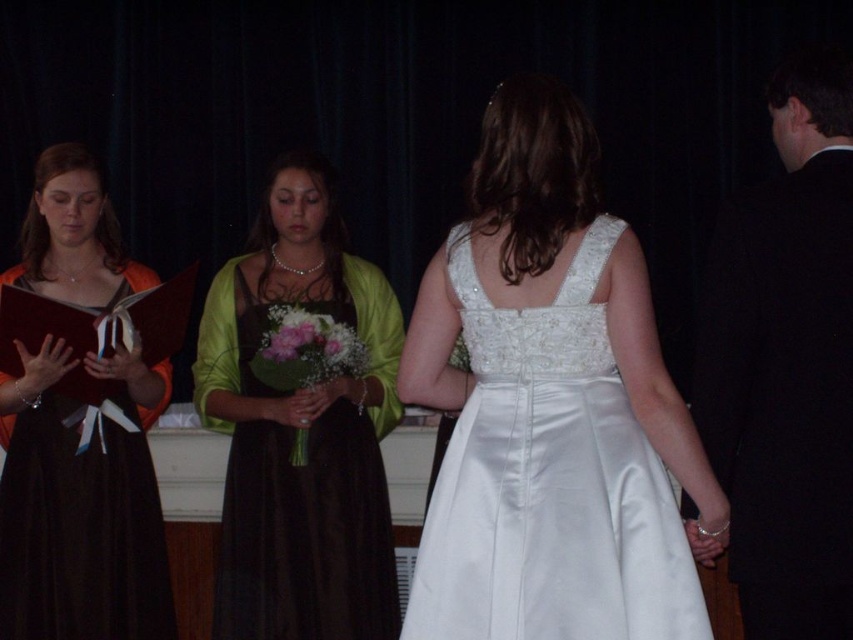
Is black satin suit at right bigger than matte brown dress at center?

No.

Between black satin suit at right and matte brown dress at center, which one appears on the left side from the viewer's perspective?

From the viewer's perspective, matte brown dress at center appears more on the left side.

Does point (798, 506) come in front of point (294, 570)?

That is True.

You are a GUI agent. You are given a task and a screenshot of the screen. Output one action in this format:
    pyautogui.click(x=<x>, y=<y>)
    Task: Click on the black satin suit at right
    The image size is (853, 640).
    Given the screenshot: What is the action you would take?
    pyautogui.click(x=786, y=362)

Can you confirm if satin white dress at center is shorter than matte brown dress at center?

Indeed, satin white dress at center has a lesser height compared to matte brown dress at center.

Does point (416, 557) come in front of point (206, 344)?

Yes, point (416, 557) is in front of point (206, 344).

Where is `satin white dress at center`? satin white dress at center is located at coordinates (549, 483).

Who is more distant from viewer, (374, 326) or (45, 385)?

Point (374, 326)

Measure the distance between matte brown dress at center and matte orange dress at left.

matte brown dress at center and matte orange dress at left are 18.32 inches apart.

Locate an element on the screen. Image resolution: width=853 pixels, height=640 pixels. matte brown dress at center is located at coordinates (300, 429).

At what (x,y) coordinates should I click in order to perform the action: click on matte brown dress at center. Please return your answer as a coordinate pair (x, y). The height and width of the screenshot is (640, 853). Looking at the image, I should click on (300, 429).